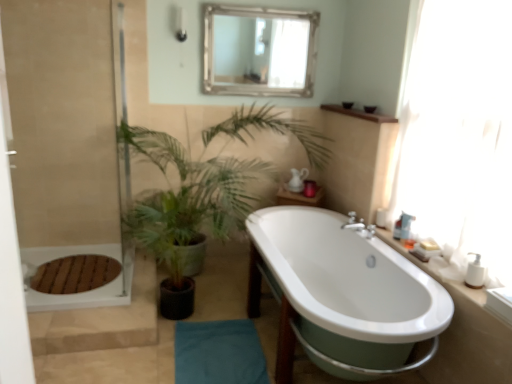
Identify the location of vacant space situated above white ceramic sink at right, the second counter top positioned from the top (from a real-world perspective). [430, 266].